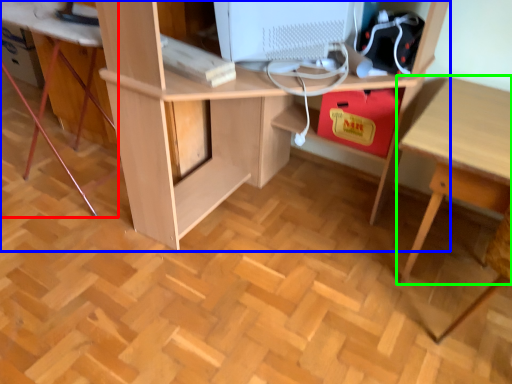
Question: Considering the real-world distances, which object is farthest from computer desk (highlighted by a red box)? desk (highlighted by a blue box) or table (highlighted by a green box)?

Choices:
 (A) desk
 (B) table

Answer: (B)